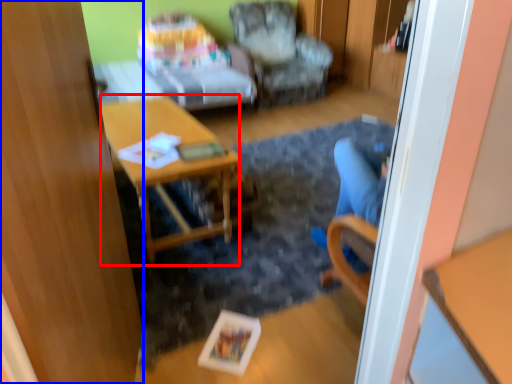
Question: Which object appears closest to the camera in this image, desk (highlighted by a red box) or glass door (highlighted by a blue box)?

Choices:
 (A) desk
 (B) glass door

Answer: (B)